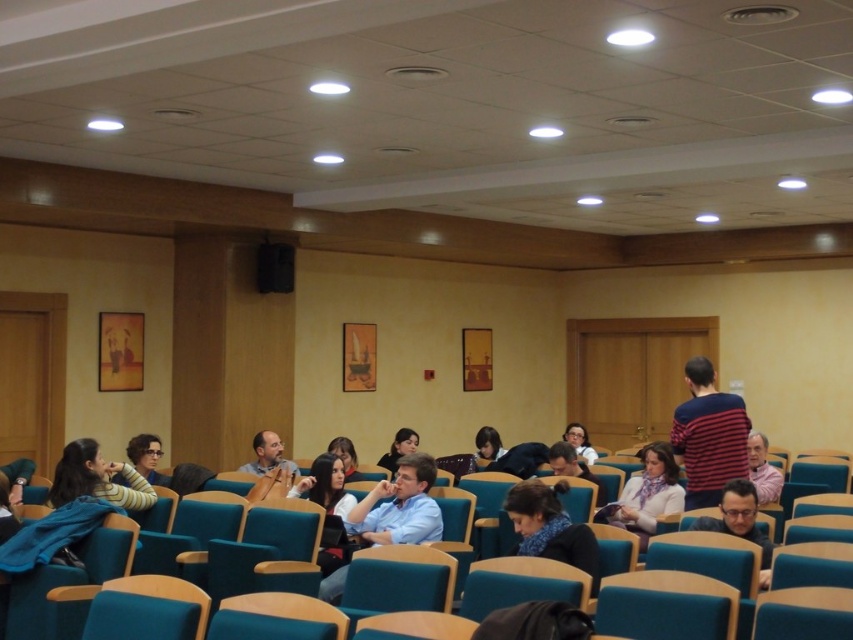
Based on the photo, you are organizing a small workshop and need to seat two participants. You have a teal fabric chair at lower center and a light blue fabric jacket at center. Which object is narrower?

The teal fabric chair at lower center is narrower than the light blue fabric jacket at center.

You are standing at the entrance of the conference room and want to find the striped cotton shirt at center. According to the room layout, where should you look to locate it?

The striped cotton shirt at center is located at the 2D coordinates point [708,435], so you should look towards the center area of the room to find it.